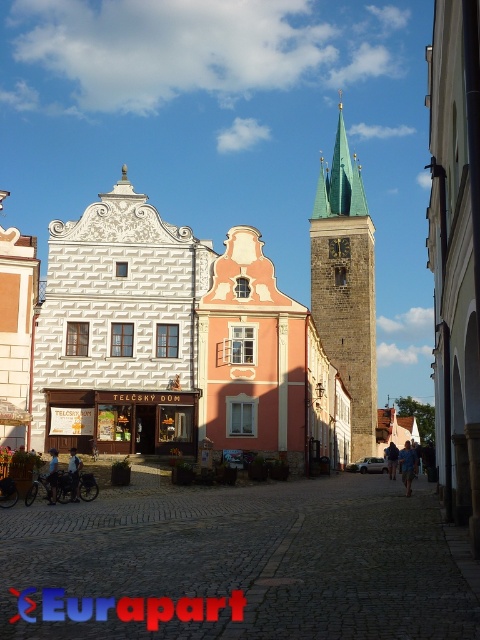
You are standing in the town square and want to take a photo of the gold textured clock at center without the stone tower at center blocking the view. Is this possible given their positions?

The stone tower at center is in front of the gold textured clock at center, so it will block the view. You cannot take a photo of the gold textured clock at center without the stone tower at center blocking it.

You are standing in the town square and want to find the stone tower at center. According to the map, there is a point marked at coordinates point (x=346, y=285). Where is this point located?

The point (x=346, y=285) is on the stone tower at center.

You are a tourist in the town square and want to take a photo of both the stone tower at center and the gold textured clock at center. Which object should you focus on first to ensure both are in frame?

Since the stone tower at center is much taller than the gold textured clock at center, you should focus on the stone tower at center first to ensure its full height is captured, allowing the clock to fit within the frame as well.